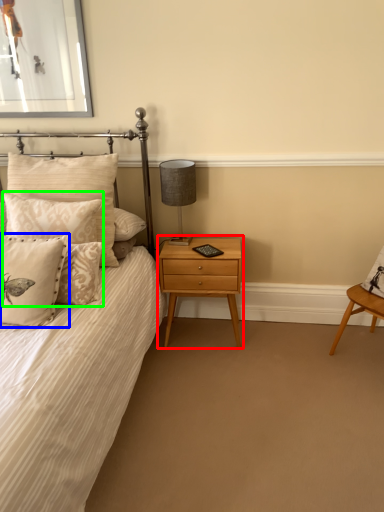
Question: Based on their relative distances, which object is nearer to nightstand (highlighted by a red box)? Choose from pillow (highlighted by a blue box) and pillow (highlighted by a green box).

Choices:
 (A) pillow
 (B) pillow

Answer: (B)